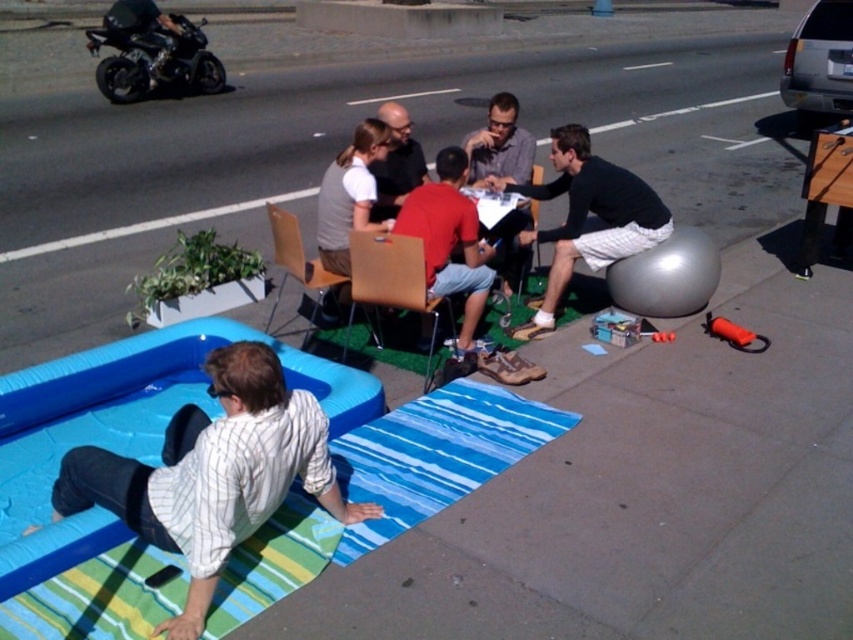
Question: Estimate the real-world distances between objects in this image. Which object is farther from the black cotton shirt at center?

Choices:
 (A) matte gray shirt at center
 (B) brown leather chair at center
 (C) brown wood chair at center

Answer: (C)

Question: Is matte red shirt at center further to camera compared to matte black shirt at center?

Choices:
 (A) yes
 (B) no

Answer: (B)

Question: Which object appears farthest from the camera in this image?

Choices:
 (A) matte red shirt at center
 (B) wooden chair at center
 (C) black cotton shirt at center

Answer: (B)

Question: In this image, where is black matte motorcycle at upper left located relative to matte red shirt at center?

Choices:
 (A) below
 (B) above

Answer: (B)

Question: Is black cotton shirt at center bigger than black matte motorcycle at upper left?

Choices:
 (A) no
 (B) yes

Answer: (A)

Question: Which point appears farthest from the camera in this image?

Choices:
 (A) (409, 118)
 (B) (297, 241)
 (C) (486, 132)

Answer: (A)